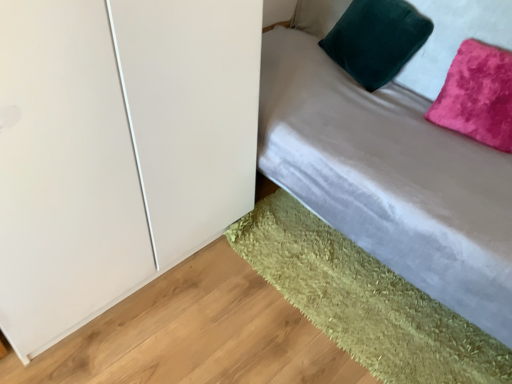
Question: From a real-world perspective, relative to velvet green pillow at upper right, the 2th pillow when ordered from right to left, is velvet gray bed at upper right vertically above or below?

Choices:
 (A) above
 (B) below

Answer: (B)

Question: In terms of size, does velvet gray bed at upper right appear bigger or smaller than velvet green pillow at upper right, the 1th pillow viewed from the left?

Choices:
 (A) big
 (B) small

Answer: (A)

Question: Considering the real-world distances, which object is closest to the velvet gray bed at upper right?

Choices:
 (A) green shaggy rug at lower right
 (B) velvet green pillow at upper right, the 1th pillow viewed from the left
 (C) pink velvet pillow at upper right, positioned as the 2th pillow in left-to-right order

Answer: (C)

Question: Which is farther from the pink velvet pillow at upper right, positioned as the 2th pillow in left-to-right order?

Choices:
 (A) velvet gray bed at upper right
 (B) green shaggy rug at lower right
 (C) velvet green pillow at upper right, the 1th pillow viewed from the left

Answer: (B)